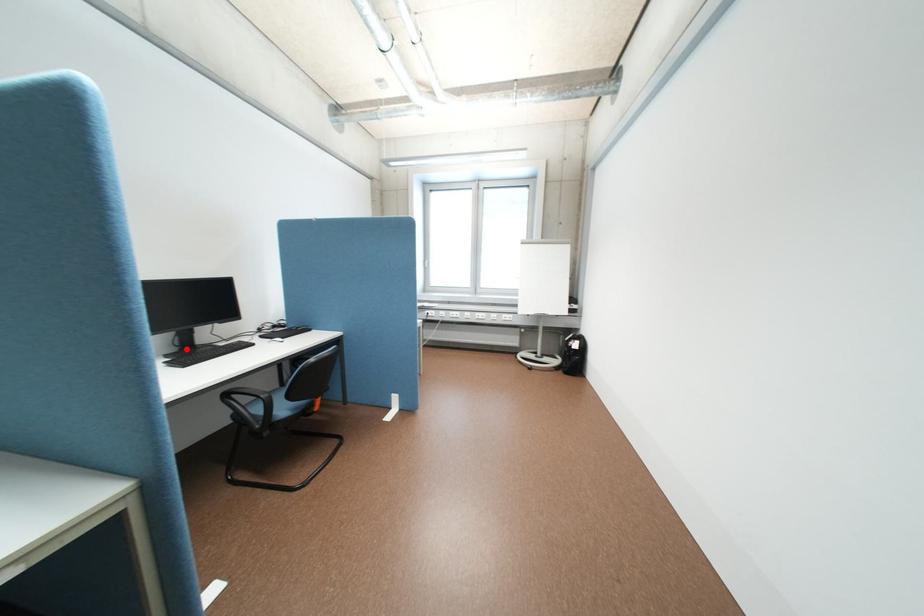
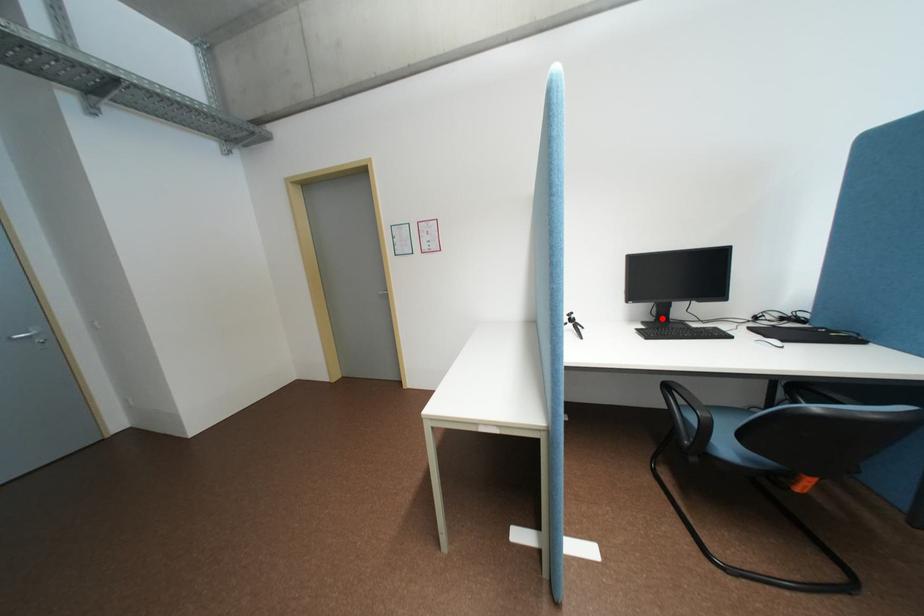
I am providing you with two images of the same scene from different viewpoints. A red point is marked on the first image and another point is marked on the second image. Is the red point in image1 aligned with the point shown in image2?

Yes